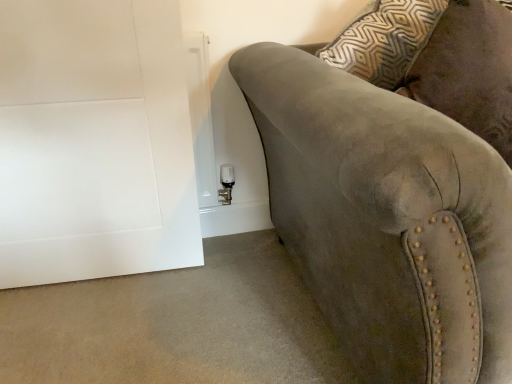
Question: Is white matte door at lower left positioned beyond the bounds of suede couch at right?

Choices:
 (A) no
 (B) yes

Answer: (B)

Question: Considering the relative positions of white matte door at lower left and suede couch at right in the image provided, is white matte door at lower left in front of suede couch at right?

Choices:
 (A) yes
 (B) no

Answer: (B)

Question: Does white matte door at lower left have a larger size compared to suede couch at right?

Choices:
 (A) no
 (B) yes

Answer: (A)

Question: Does white matte door at lower left have a greater height compared to suede couch at right?

Choices:
 (A) no
 (B) yes

Answer: (B)

Question: From a real-world perspective, is white matte door at lower left under suede couch at right?

Choices:
 (A) no
 (B) yes

Answer: (A)

Question: Is white matte door at lower left not near suede couch at right?

Choices:
 (A) no
 (B) yes

Answer: (A)

Question: From a real-world perspective, does suede couch at right sit lower than white matte door at lower left?

Choices:
 (A) no
 (B) yes

Answer: (B)

Question: Considering the relative sizes of suede couch at right and white matte door at lower left in the image provided, is suede couch at right wider than white matte door at lower left?

Choices:
 (A) yes
 (B) no

Answer: (A)

Question: Does suede couch at right have a lesser height compared to white matte door at lower left?

Choices:
 (A) no
 (B) yes

Answer: (B)

Question: From the image's perspective, is suede couch at right located above white matte door at lower left?

Choices:
 (A) yes
 (B) no

Answer: (B)

Question: Is white matte door at lower left at the back of suede couch at right?

Choices:
 (A) no
 (B) yes

Answer: (A)

Question: Is suede couch at right smaller than white matte door at lower left?

Choices:
 (A) no
 (B) yes

Answer: (A)

Question: Considering their positions, is white matte door at lower left located in front of or behind suede couch at right?

Choices:
 (A) behind
 (B) front

Answer: (A)